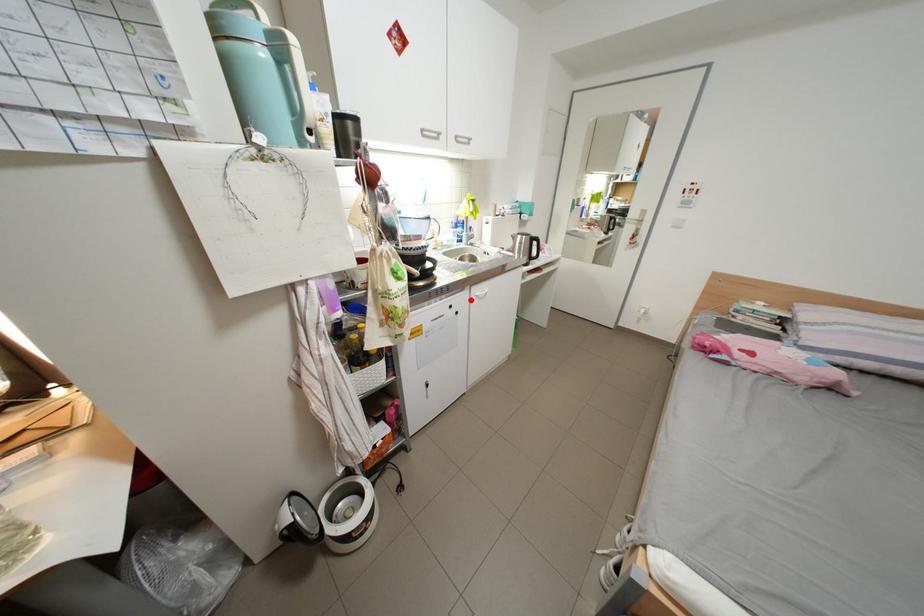
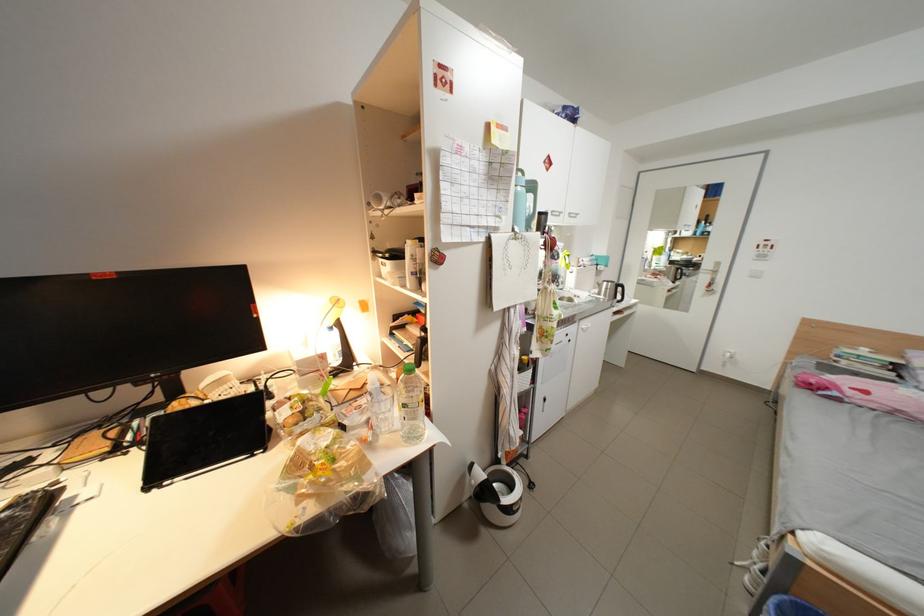
Where in the second image is the point corresponding to the highlighted location from the first image?

(582, 331)